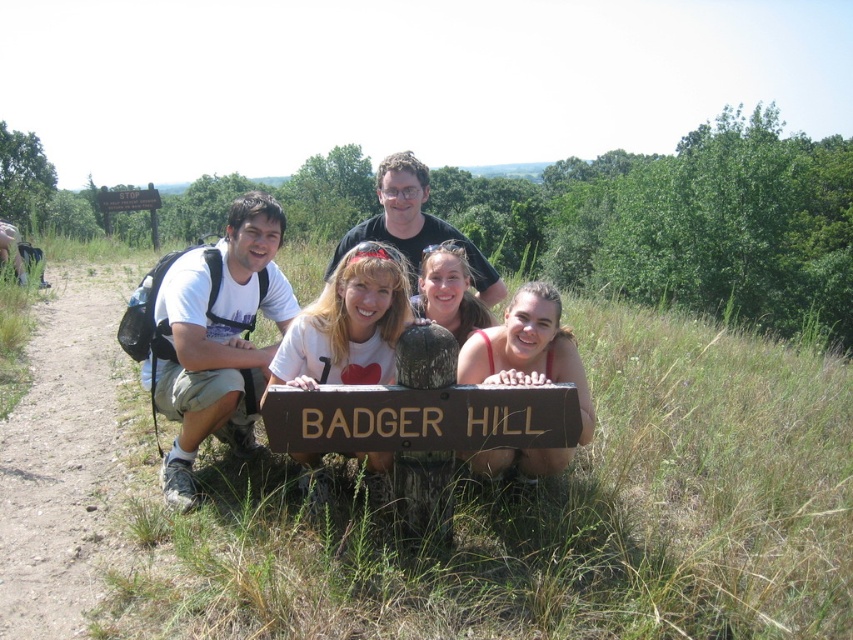
Question: Considering the relative positions of dirt path at left and matte white shirt at center in the image provided, where is dirt path at left located with respect to matte white shirt at center?

Choices:
 (A) below
 (B) above

Answer: (A)

Question: In this image, where is white matte shirt at center located relative to matte white shirt at center?

Choices:
 (A) left
 (B) right

Answer: (A)

Question: Which point is farther to the camera?

Choices:
 (A) matte white t-shirt at left
 (B) dirt path at left
 (C) brown wooden sign at center

Answer: (A)

Question: Is white matte shirt at center above brown wooden sign at upper center?

Choices:
 (A) no
 (B) yes

Answer: (A)

Question: Among these objects, which one is farthest from the camera?

Choices:
 (A) white matte shirt at center
 (B) matte white t-shirt at left
 (C) brown wooden sign at upper center
 (D) smooth tan skin at center

Answer: (C)

Question: Estimate the real-world distances between objects in this image. Which object is farther from the dirt path at left?

Choices:
 (A) white matte shirt at center
 (B) matte white shirt at center

Answer: (B)